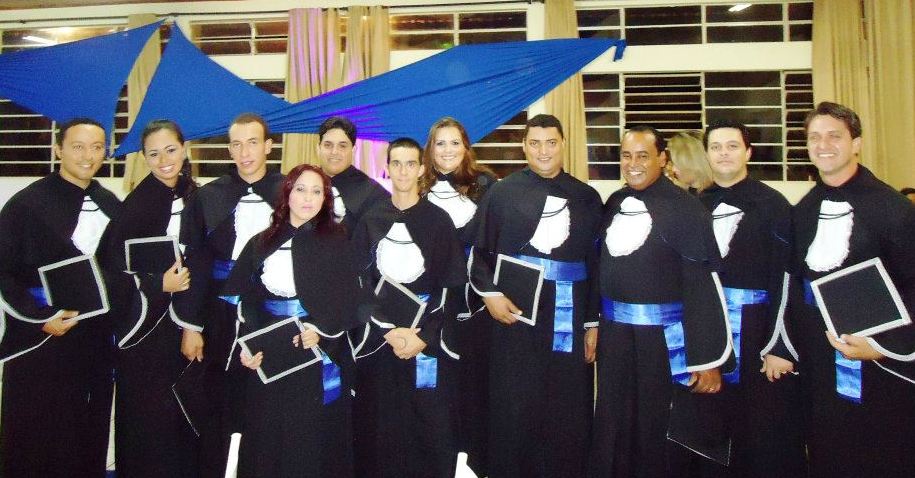
Where is `papers`? papers is located at coordinates (496, 296).